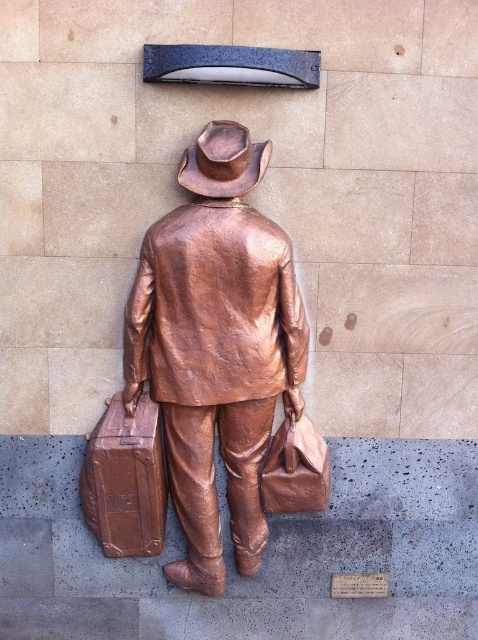
Question: Where is bronze statue at center located in relation to shiny brown suitcase at lower left in the image?

Choices:
 (A) above
 (B) below

Answer: (A)

Question: Which object appears farthest from the camera in this image?

Choices:
 (A) bronze/copper cowboy hat at upper center
 (B) shiny brown suitcase at lower left
 (C) bronze statue at center

Answer: (B)

Question: Which of these objects is positioned closest to the bronze/copper cowboy hat at upper center?

Choices:
 (A) bronze statue at center
 (B) shiny brown suitcase at lower left

Answer: (A)

Question: Is shiny brown suitcase at lower left smaller than bronze/copper cowboy hat at upper center?

Choices:
 (A) no
 (B) yes

Answer: (A)

Question: Observing the image, what is the correct spatial positioning of shiny brown suitcase at lower left in reference to bronze/copper cowboy hat at upper center?

Choices:
 (A) left
 (B) right

Answer: (A)

Question: Estimate the real-world distances between objects in this image. Which object is farther from the shiny brown suitcase at lower left?

Choices:
 (A) bronze statue at center
 (B) bronze/copper cowboy hat at upper center

Answer: (B)